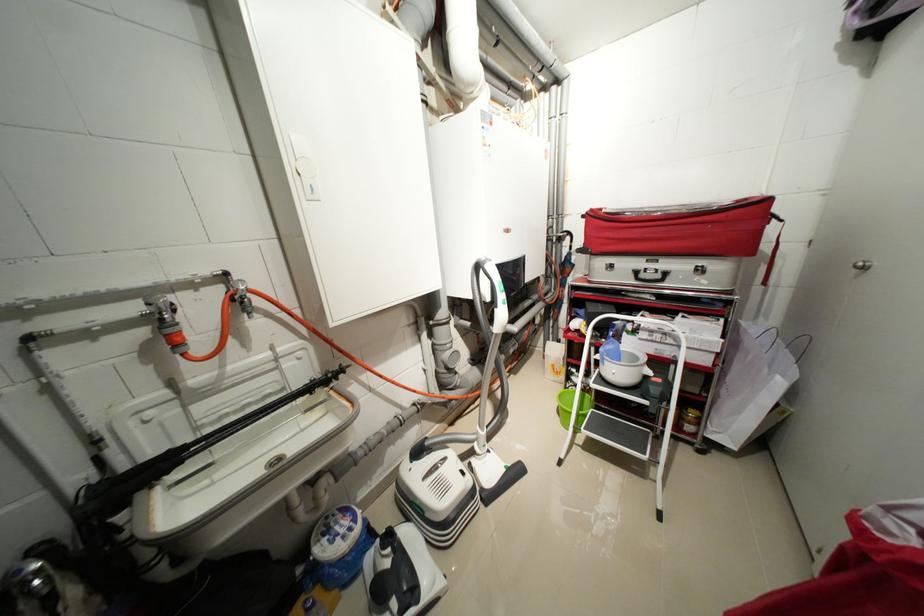
Where would you turn the silver door knob? Please return your answer as a coordinate pair (x, y).

(861, 265)